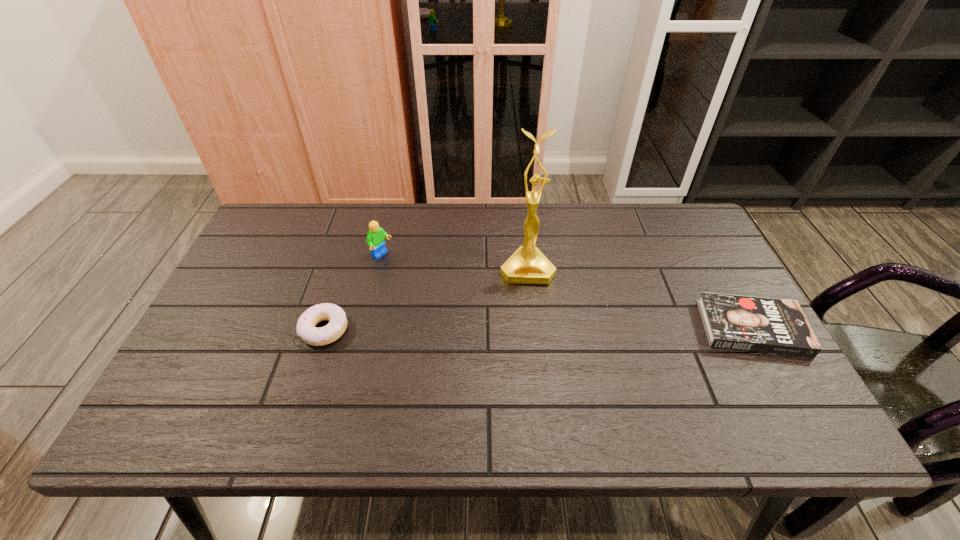
This screenshot has width=960, height=540. Find the location of `free space located 0.320m on the front-facing side of the tallest object`. free space located 0.320m on the front-facing side of the tallest object is located at coordinates (542, 388).

Where is `free space located on the front-facing side of the tallest object`? free space located on the front-facing side of the tallest object is located at coordinates (543, 392).

This screenshot has height=540, width=960. In order to click on vacant area situated on the front-facing side of the tallest object in this screenshot , I will do `click(536, 335)`.

The width and height of the screenshot is (960, 540). What are the coordinates of `free space located on the face of the second object from left to right` in the screenshot? It's located at (421, 280).

I want to click on vacant point located 0.230m on the face of the second object from left to right, so click(x=447, y=297).

You are a GUI agent. You are given a task and a screenshot of the screen. Output one action in this format:
    pyautogui.click(x=<x>, y=<y>)
    Task: Click on the free space located 0.190m on the face of the second object from left to right
    The image size is (960, 540).
    Given the screenshot: What is the action you would take?
    pyautogui.click(x=437, y=291)

Where is `award that is at the far edge`? Image resolution: width=960 pixels, height=540 pixels. award that is at the far edge is located at coordinates (527, 265).

I want to click on Lego at the far edge, so click(375, 239).

The height and width of the screenshot is (540, 960). I want to click on object that is at the right edge, so pos(756,324).

Image resolution: width=960 pixels, height=540 pixels. In the image, there is a desktop. In order to click on blank space at the far edge in this screenshot , I will do pyautogui.click(x=564, y=229).